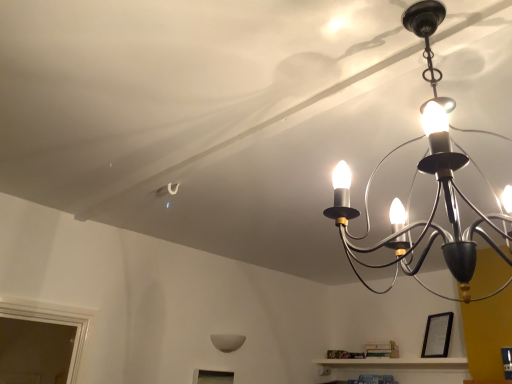
Question: Is matte black chandelier at upper right, positioned as the second lamp in bottom-to-top order, closer to the viewer compared to white matte wall sconce at lower center, which is the first lamp in left-to-right order?

Choices:
 (A) no
 (B) yes

Answer: (B)

Question: From the image's perspective, is matte black chandelier at upper right, which ranks as the first lamp in right-to-left order, on white matte wall sconce at lower center, marked as the second lamp in a top-to-bottom arrangement?

Choices:
 (A) yes
 (B) no

Answer: (A)

Question: Is white matte wall sconce at lower center, which is the first lamp in left-to-right order, inside matte black chandelier at upper right, which is the second lamp from back to front?

Choices:
 (A) yes
 (B) no

Answer: (B)

Question: Considering the relative sizes of matte black chandelier at upper right, positioned as the second lamp in bottom-to-top order, and white matte wall sconce at lower center, arranged as the first lamp when ordered from the bottom, in the image provided, is matte black chandelier at upper right, positioned as the second lamp in bottom-to-top order, smaller than white matte wall sconce at lower center, arranged as the first lamp when ordered from the bottom,?

Choices:
 (A) yes
 (B) no

Answer: (B)

Question: Does matte black chandelier at upper right, which is the second lamp from back to front, have a lesser width compared to white matte wall sconce at lower center, which appears as the 2th lamp when viewed from the right?

Choices:
 (A) yes
 (B) no

Answer: (B)

Question: From the image's perspective, is black matte picture frame at lower right positioned above or below white matte wall sconce at lower center, which is counted as the 1th lamp, starting from the back?

Choices:
 (A) below
 (B) above

Answer: (B)

Question: From their relative heights in the image, would you say black matte picture frame at lower right is taller or shorter than white matte wall sconce at lower center, which appears as the 2th lamp when viewed from the right?

Choices:
 (A) short
 (B) tall

Answer: (B)

Question: Is black matte picture frame at lower right to the left or to the right of white matte wall sconce at lower center, which is counted as the 1th lamp, starting from the back, in the image?

Choices:
 (A) left
 (B) right

Answer: (B)

Question: From a real-world perspective, relative to white matte wall sconce at lower center, which appears as the 2th lamp when viewed from the right, is black matte picture frame at lower right vertically above or below?

Choices:
 (A) below
 (B) above

Answer: (B)

Question: From the image's perspective, is matte black chandelier at upper right, marked as the 1th lamp in a top-to-bottom arrangement, located above or below white matte wall sconce at lower center, which is counted as the 1th lamp, starting from the back?

Choices:
 (A) above
 (B) below

Answer: (A)

Question: From a real-world perspective, relative to white matte wall sconce at lower center, which is the second lamp from front to back, is matte black chandelier at upper right, the 2th lamp when ordered from left to right, vertically above or below?

Choices:
 (A) above
 (B) below

Answer: (A)

Question: In terms of width, does matte black chandelier at upper right, which ranks as the 1th lamp in front-to-back order, look wider or thinner when compared to white matte wall sconce at lower center, which appears as the 2th lamp when viewed from the right?

Choices:
 (A) thin
 (B) wide

Answer: (B)

Question: Do you think matte black chandelier at upper right, positioned as the second lamp in bottom-to-top order, is within white matte wall sconce at lower center, marked as the second lamp in a top-to-bottom arrangement, or outside of it?

Choices:
 (A) outside
 (B) inside

Answer: (A)

Question: Is point (425, 349) closer or farther from the camera than point (327, 215)?

Choices:
 (A) closer
 (B) farther

Answer: (B)

Question: From the image's perspective, is black matte picture frame at lower right located above or below matte black chandelier at upper right, marked as the 1th lamp in a top-to-bottom arrangement?

Choices:
 (A) below
 (B) above

Answer: (A)